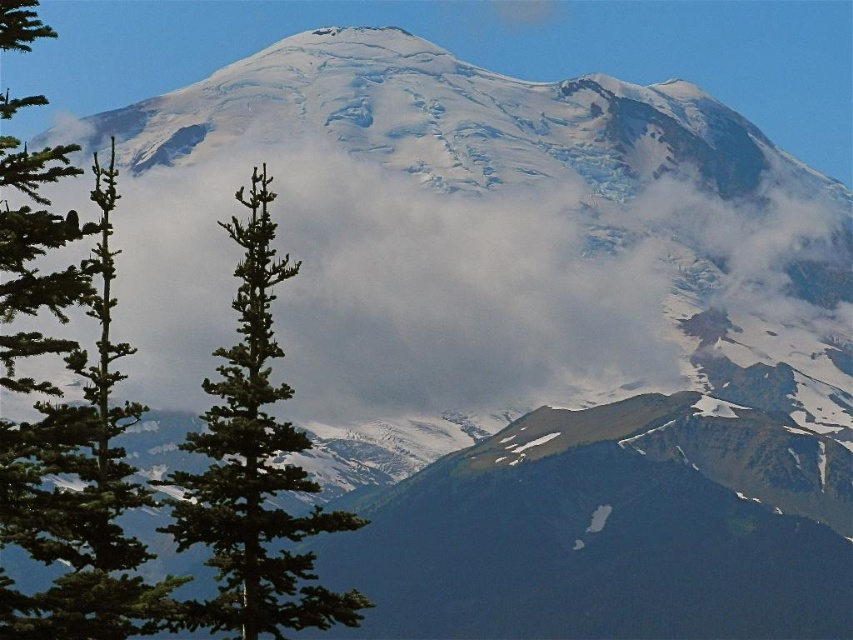
Question: In this image, where is green needle-like tree at left located relative to green textured pine tree at center?

Choices:
 (A) right
 (B) left

Answer: (B)

Question: Does green needle-like tree at left appear under green textured pine tree at center?

Choices:
 (A) yes
 (B) no

Answer: (B)

Question: Is green needle-like tree at left smaller than green textured pine tree at center?

Choices:
 (A) no
 (B) yes

Answer: (A)

Question: Which point is closer to the camera?

Choices:
 (A) green needle-like tree at left
 (B) green textured pine tree at center

Answer: (A)